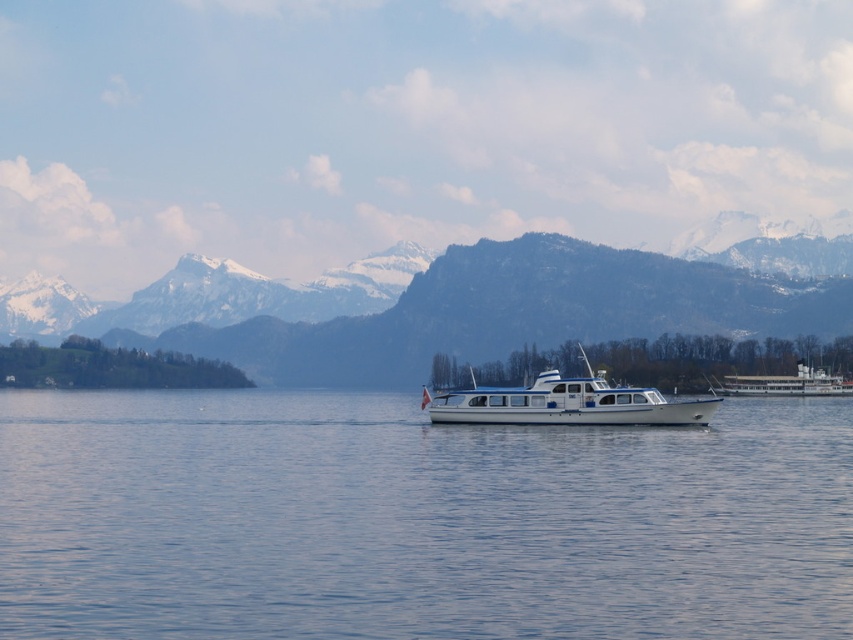
From the picture: You are standing at the lakeside and want to reach a specific point marked at coordinates point (141, 522). If your maximum walking distance is 70 meters, will you be able to reach that point without swimming?

The distance of point (141, 522) from viewer is 80.19 meters, which exceeds your maximum walking distance of 70 meters. Therefore, you cannot reach that point without swimming.

You are a photographer planning to capture the snowy rock mountain range at left in your shot. The camera you are using has a rectangular sensor with a width of 0.5 units. If the mountain range is located at point 0.475, 0.553 in the image, will the entire mountain range fit within the sensor?

The snowy rock mountain range at left is located at point (471, 304). Since the sensor width is 0.5 units, the mountain range will fit within the sensor as long as its width does not exceed the sensor width. However, the exact width of the mountain range is not provided, so we cannot definitively confirm if it will fit.

You are a photographer planning to capture the entire scene of the blue water at center and the snowy rock mountain range at left in a single frame. Based on their sizes, which object should you focus on to ensure both are visible without cropping?

The blue water at center has a smaller size compared to the snowy rock mountain range at left, so you should focus on the snowy rock mountain range at left to ensure both are visible without cropping.